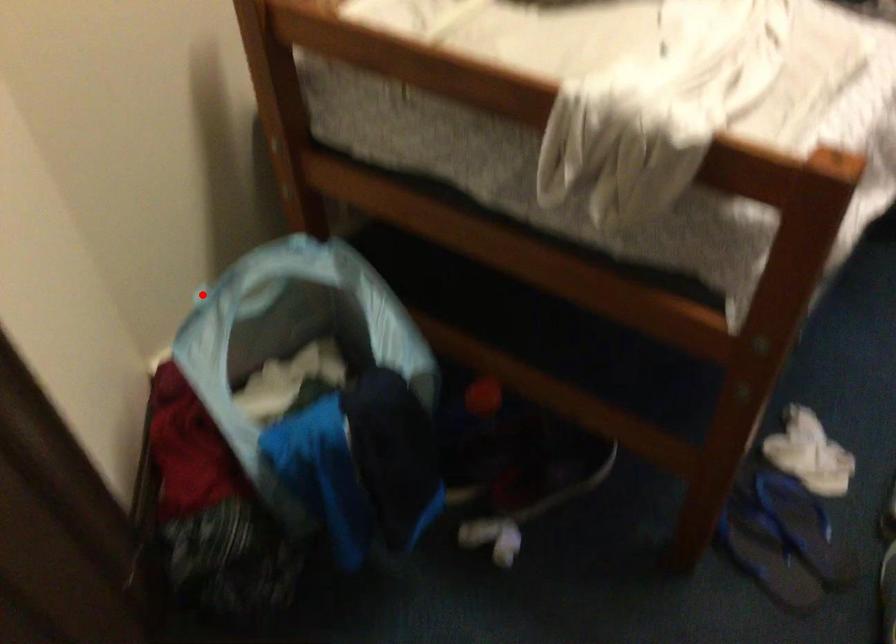
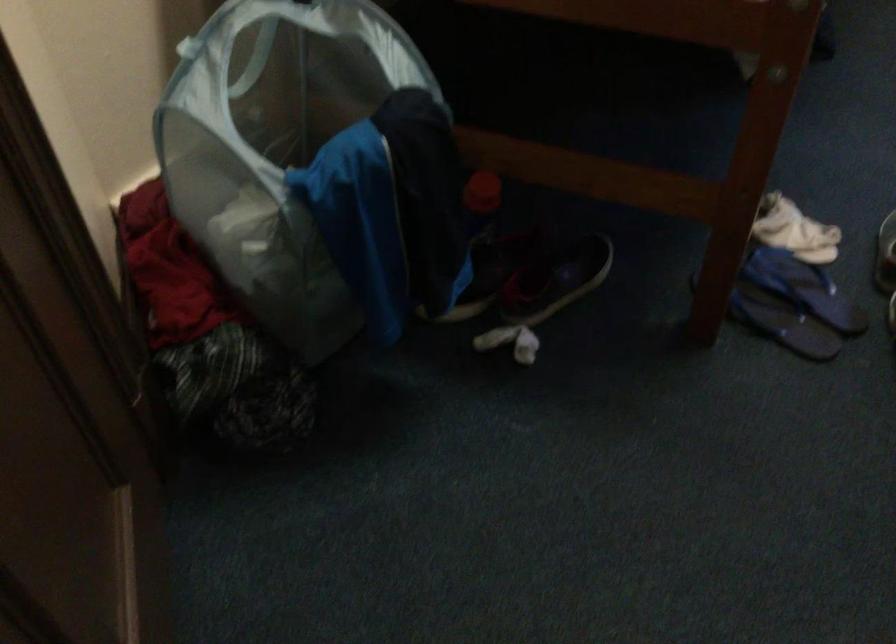
Question: I am providing you with two images of the same scene from different viewpoints. In image1, a red point is highlighted. Considering the same 3D point in image2, which of the following is correct?

Choices:
 (A) It is closer
 (B) It is farther

Answer: (A)